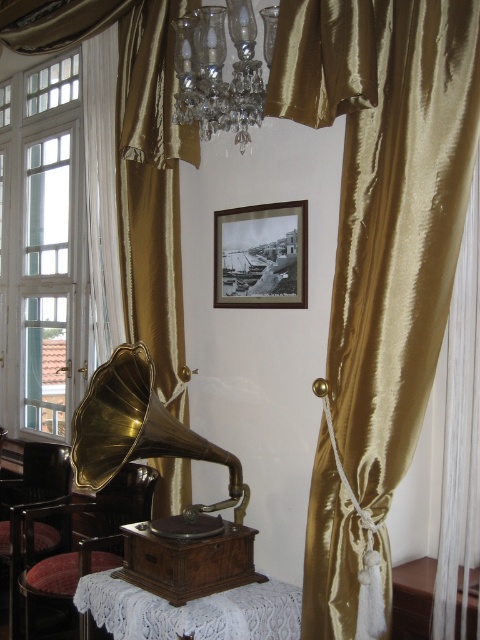
You are sitting on the velvet red chair at lower left and want to place a book on the white lace table at lower center. Can you reach the table without getting up?

The velvet red chair at lower left is taller than the white lace table at lower center, so you can easily reach the table from the chair without needing to stand up.

You are a delivery person trying to place a package on the table. The package is 2 meters long. Can you place it on the white lace table at center without it hanging off the edge? The white glass window at left is nearby. Please consider the distance between them.

The white glass window at left is 1.87 meters away from the white lace table at center. Since the package is 2 meters long, it would extend beyond the edge of the table, so it cannot be placed without hanging off.